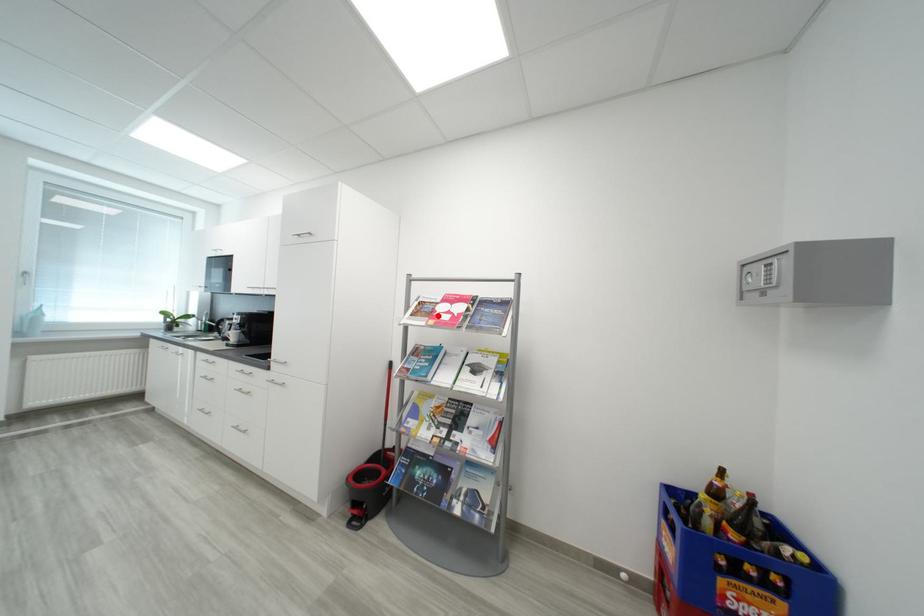
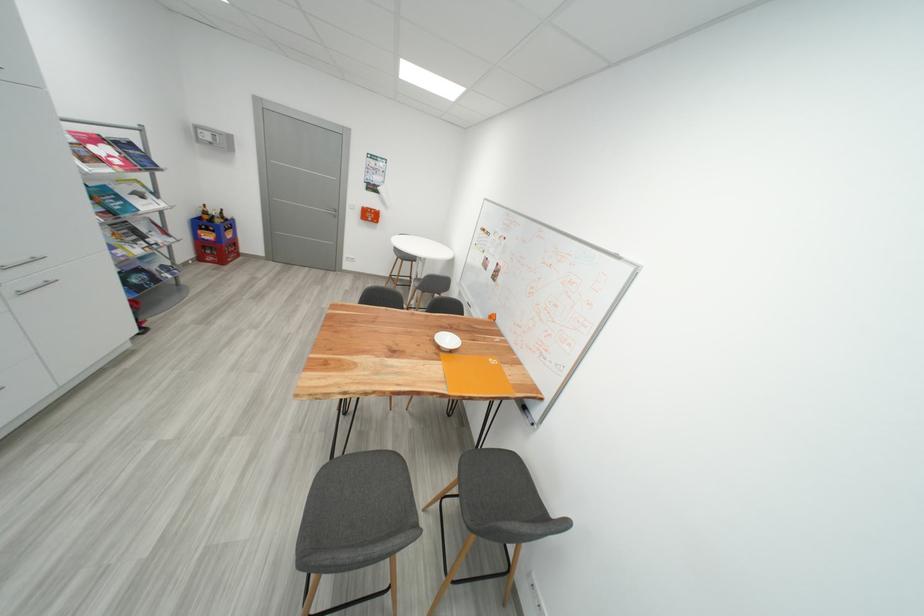
Locate, in the second image, the point that corresponds to the highlighted location in the first image.

(104, 161)